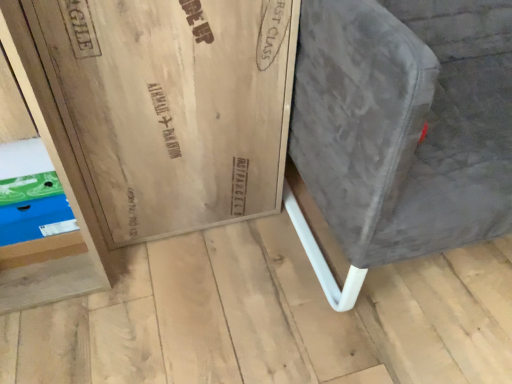
In the scene shown: What is the approximate height of velvet grey armchair at right?

The height of velvet grey armchair at right is 27.45 inches.

In order to face velvet grey armchair at right, should I rotate leftwards or rightwards?

You should rotate right by 28.711 degrees.

The image size is (512, 384). Describe the element at coordinates (402, 129) in the screenshot. I see `velvet grey armchair at right` at that location.

The height and width of the screenshot is (384, 512). Find the location of `velvet grey armchair at right`. velvet grey armchair at right is located at coordinates (402, 129).

What do you see at coordinates (41, 250) in the screenshot? I see `blue cardboard shoebox at lower left` at bounding box center [41, 250].

Locate an element on the screen. The image size is (512, 384). blue cardboard shoebox at lower left is located at coordinates (41, 250).

Measure the distance between point (6,169) and camera.

90.70 centimeters.

Image resolution: width=512 pixels, height=384 pixels. What are the coordinates of `velvet grey armchair at right` in the screenshot? It's located at (402, 129).

Is velvet grey armchair at right to the left of blue cardboard shoebox at lower left from the viewer's perspective?

In fact, velvet grey armchair at right is to the right of blue cardboard shoebox at lower left.

Which object is closer to the camera taking this photo, velvet grey armchair at right or blue cardboard shoebox at lower left?

velvet grey armchair at right is in front.

Which is nearer, [318,264] or [33,139]?

The point [33,139] is more forward.

From the image's perspective, would you say velvet grey armchair at right is shown under blue cardboard shoebox at lower left?

No.

From a real-world perspective, is velvet grey armchair at right on top of blue cardboard shoebox at lower left?

Yes, from a real-world perspective, velvet grey armchair at right is on top of blue cardboard shoebox at lower left.

From the picture: Does velvet grey armchair at right have a greater width compared to blue cardboard shoebox at lower left?

Indeed, velvet grey armchair at right has a greater width compared to blue cardboard shoebox at lower left.

Who is taller, velvet grey armchair at right or blue cardboard shoebox at lower left?

velvet grey armchair at right is taller.

Which of these two, velvet grey armchair at right or blue cardboard shoebox at lower left, is bigger?

With larger size is velvet grey armchair at right.

Is velvet grey armchair at right not inside blue cardboard shoebox at lower left?

Yes, velvet grey armchair at right is outside of blue cardboard shoebox at lower left.

Is there a large distance between velvet grey armchair at right and blue cardboard shoebox at lower left?

velvet grey armchair at right is near blue cardboard shoebox at lower left, not far away.

Is velvet grey armchair at right positioned with its back to blue cardboard shoebox at lower left?

velvet grey armchair at right does not have its back to blue cardboard shoebox at lower left.

How distant is velvet grey armchair at right from blue cardboard shoebox at lower left?

34.61 inches.

Identify the location of shelf located on the left of velvet grey armchair at right. pyautogui.click(x=41, y=250).

Is blue cardboard shoebox at lower left at the right side of velvet grey armchair at right?

Incorrect, blue cardboard shoebox at lower left is not on the right side of velvet grey armchair at right.

Which object is further away from the camera taking this photo, blue cardboard shoebox at lower left or velvet grey armchair at right?

blue cardboard shoebox at lower left is more distant.

Between point (0, 168) and point (441, 183), which one is positioned in front?

The point (441, 183) is closer.

From the image's perspective, is blue cardboard shoebox at lower left above velvet grey armchair at right?

No.

From a real-world perspective, is blue cardboard shoebox at lower left physically above velvet grey armchair at right?

No, from a real-world perspective, blue cardboard shoebox at lower left is not above velvet grey armchair at right.

Which of these two, blue cardboard shoebox at lower left or velvet grey armchair at right, is thinner?

→ blue cardboard shoebox at lower left.

Considering the sizes of blue cardboard shoebox at lower left and velvet grey armchair at right in the image, is blue cardboard shoebox at lower left taller or shorter than velvet grey armchair at right?

Clearly, blue cardboard shoebox at lower left is shorter compared to velvet grey armchair at right.

Is blue cardboard shoebox at lower left smaller than velvet grey armchair at right?

Yes, blue cardboard shoebox at lower left is smaller than velvet grey armchair at right.

Can we say blue cardboard shoebox at lower left lies outside velvet grey armchair at right?

blue cardboard shoebox at lower left lies outside velvet grey armchair at right's area.

Would you say blue cardboard shoebox at lower left is a long distance from velvet grey armchair at right?

No, blue cardboard shoebox at lower left is not far away from velvet grey armchair at right.

Looking at this image, is blue cardboard shoebox at lower left positioned with its back to velvet grey armchair at right?

blue cardboard shoebox at lower left does not have its back to velvet grey armchair at right.

How many degrees apart are the facing directions of blue cardboard shoebox at lower left and velvet grey armchair at right?

They differ by 3.32 degrees in their facing directions.

The image size is (512, 384). What are the coordinates of `shelf below the velvet grey armchair at right (from the image's perspective)` in the screenshot? It's located at (41, 250).

The image size is (512, 384). I want to click on furniture lying in front of the blue cardboard shoebox at lower left, so click(402, 129).

The width and height of the screenshot is (512, 384). Identify the location of shelf behind the velvet grey armchair at right. (41, 250).